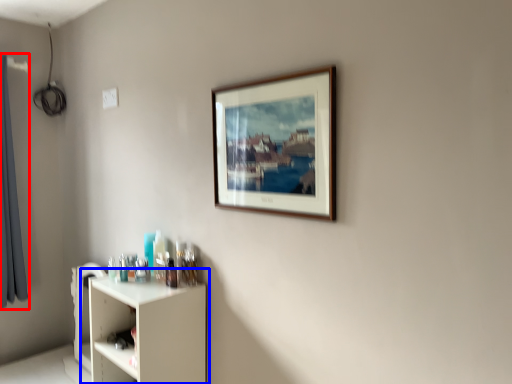
Question: Which object is closer to the camera taking this photo, curtain (highlighted by a red box) or shelf (highlighted by a blue box)?

Choices:
 (A) curtain
 (B) shelf

Answer: (B)